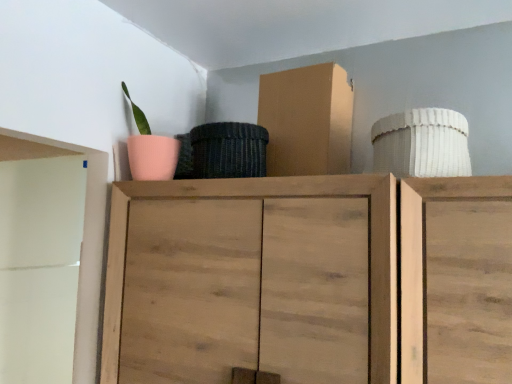
Question: Is cardboard box at upper center inside the boundaries of wooden cabinet at center, or outside?

Choices:
 (A) outside
 (B) inside

Answer: (A)

Question: From a real-world perspective, is cardboard box at upper center physically located above or below wooden cabinet at center?

Choices:
 (A) above
 (B) below

Answer: (A)

Question: Visually, is cardboard box at upper center positioned to the left or to the right of wooden cabinet at center?

Choices:
 (A) left
 (B) right

Answer: (B)

Question: Do you think wooden cabinet at center is within cardboard box at upper center, or outside of it?

Choices:
 (A) outside
 (B) inside

Answer: (A)

Question: In terms of width, does wooden cabinet at center look wider or thinner when compared to cardboard box at upper center?

Choices:
 (A) thin
 (B) wide

Answer: (B)

Question: From their relative heights in the image, would you say wooden cabinet at center is taller or shorter than cardboard box at upper center?

Choices:
 (A) tall
 (B) short

Answer: (A)

Question: From the image's perspective, is wooden cabinet at center above or below cardboard box at upper center?

Choices:
 (A) above
 (B) below

Answer: (B)